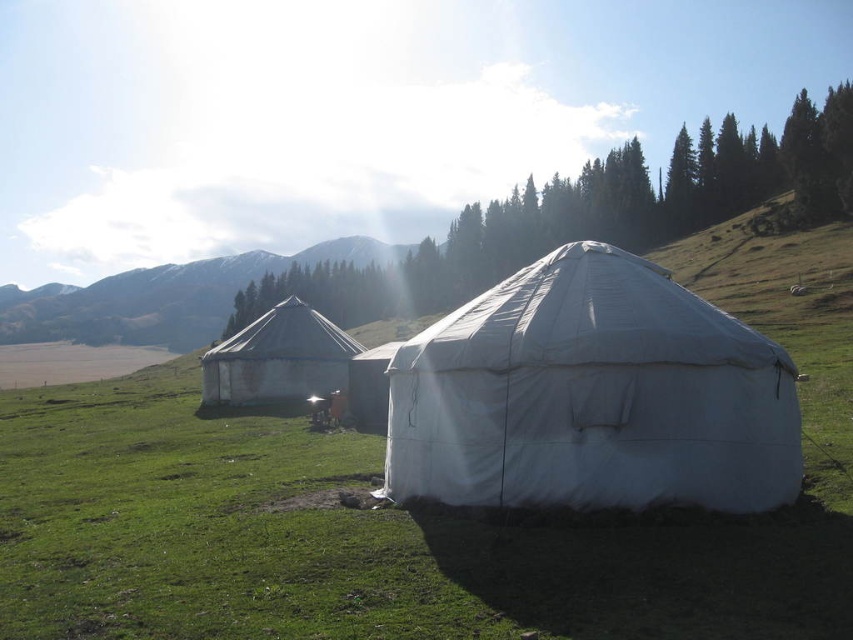
Question: Which of these objects is positioned closest to the white fabric tent at center?

Choices:
 (A) white canvas tent at center
 (B) white canvas tent at left

Answer: (B)

Question: Which point is farther to the camera?

Choices:
 (A) white fabric tent at center
 (B) white canvas tent at center
 (C) white canvas tent at left

Answer: (A)

Question: Is white canvas tent at center bigger than white canvas tent at left?

Choices:
 (A) yes
 (B) no

Answer: (B)

Question: Can you confirm if white canvas tent at center is thinner than white canvas tent at left?

Choices:
 (A) yes
 (B) no

Answer: (A)

Question: Estimate the real-world distances between objects in this image. Which object is closer to the white canvas tent at left?

Choices:
 (A) white fabric tent at center
 (B) white canvas tent at center

Answer: (B)

Question: Is white fabric tent at center further to the viewer compared to white canvas tent at left?

Choices:
 (A) no
 (B) yes

Answer: (B)